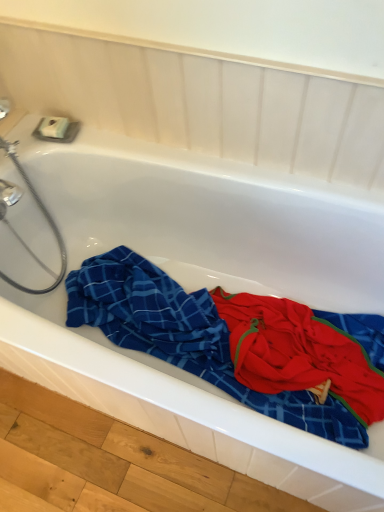
This screenshot has width=384, height=512. Describe the element at coordinates (186, 337) in the screenshot. I see `blue plaid towel at center` at that location.

Locate an element on the screen. blue plaid towel at center is located at coordinates (186, 337).

This screenshot has height=512, width=384. Find the location of `blue plaid towel at center`. blue plaid towel at center is located at coordinates (186, 337).